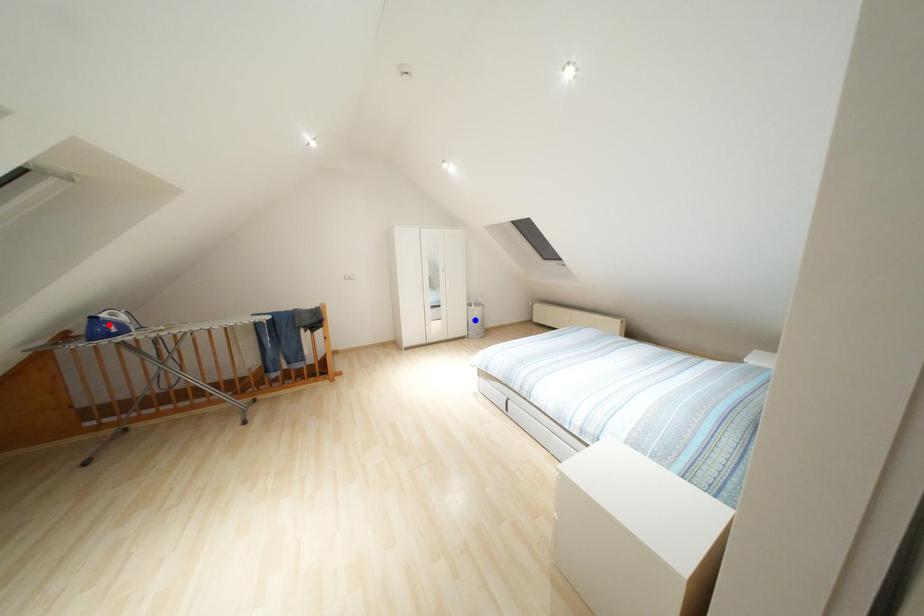
Question: Which of the two points in the image is closer to the camera?

Choices:
 (A) Blue point is closer.
 (B) Red point is closer.

Answer: (B)